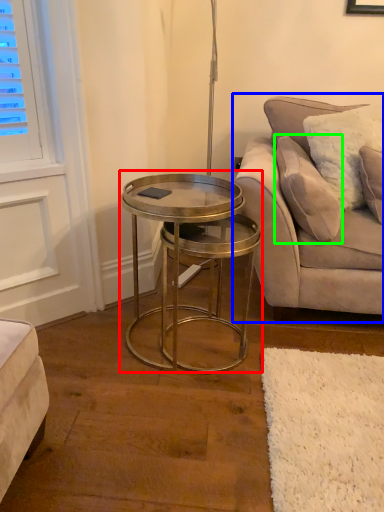
Question: Based on their relative distances, which object is farther from coffee table (highlighted by a red box)? Choose from studio couch (highlighted by a blue box) and pillow (highlighted by a green box).

Choices:
 (A) studio couch
 (B) pillow

Answer: (B)